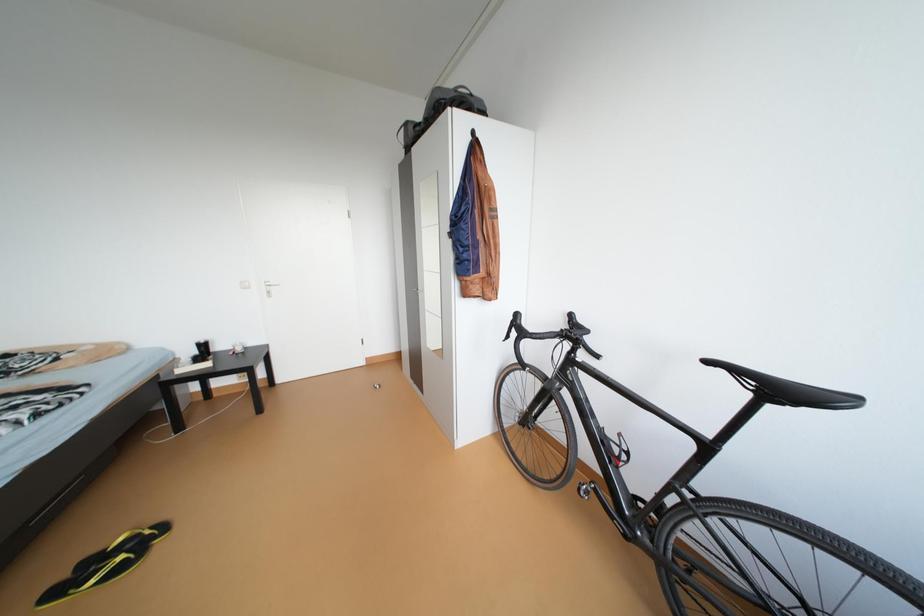
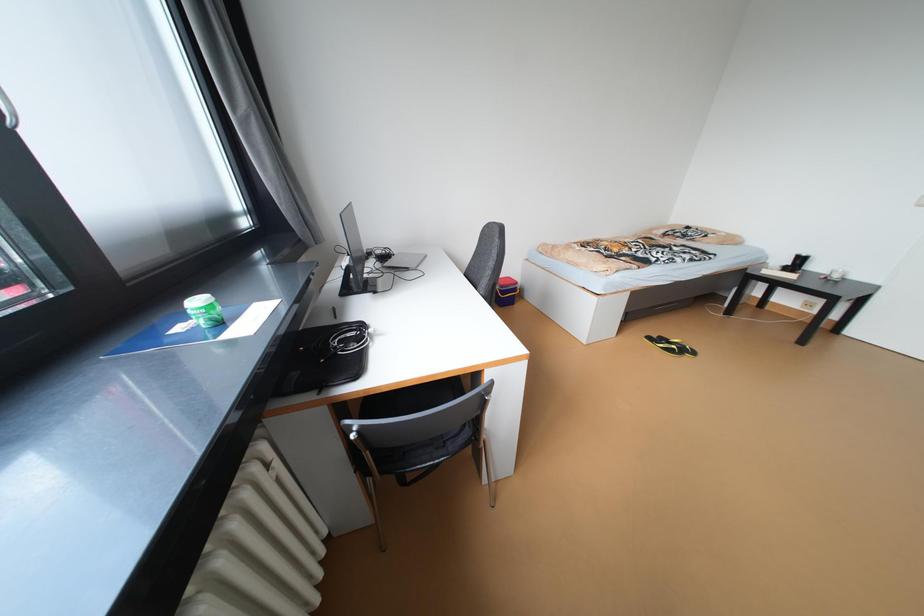
First-person continuous shooting, in which direction is the camera rotating?

The rotation direction of the camera is left-down.